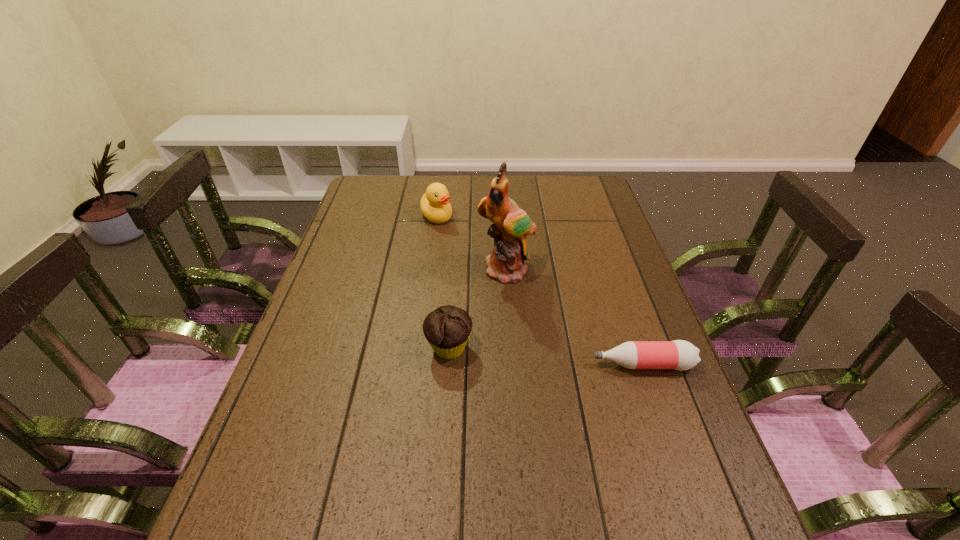
Where is `the second shortest object`? the second shortest object is located at coordinates (447, 328).

What are the coordinates of `the shortest object` in the screenshot? It's located at (681, 355).

Where is `bottle`? bottle is located at coordinates (681, 355).

Image resolution: width=960 pixels, height=540 pixels. In order to click on duck in this screenshot , I will do `click(434, 204)`.

Image resolution: width=960 pixels, height=540 pixels. Identify the location of the third shortest object. (434, 204).

This screenshot has height=540, width=960. In order to click on the third object from left to right in this screenshot , I will do `click(511, 224)`.

Where is `the second farthest object`? The width and height of the screenshot is (960, 540). the second farthest object is located at coordinates (511, 224).

The width and height of the screenshot is (960, 540). In order to click on free spot located 0.240m on the right of the second shortest object in this screenshot , I will do `click(570, 348)`.

Where is `free location located with the cap open on the bottle`? The image size is (960, 540). free location located with the cap open on the bottle is located at coordinates (513, 364).

This screenshot has width=960, height=540. In order to click on vacant area situated with the cap open on the bottle in this screenshot , I will do `click(424, 364)`.